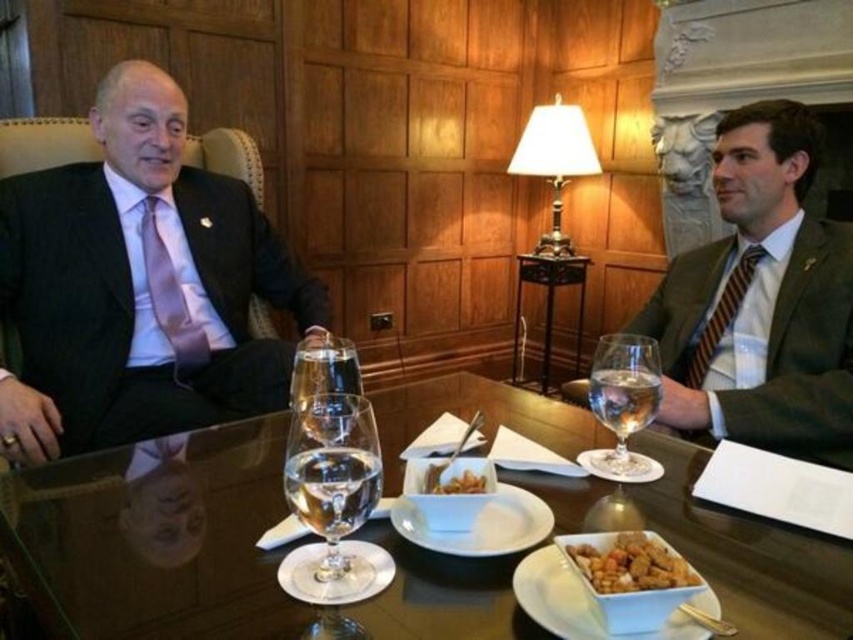
Looking at this image, you are organizing a formal event and need to determine which item takes up more space between the dark suit at left and the striped fabric tie at right. Which one should you consider for space requirements?

The dark suit at left is larger in size than the striped fabric tie at right, so you should consider the dark suit at left for space requirements.

You are an interior designer observing the scene. You need to place a decorative item between the dark suit at left and the striped fabric tie at right. Based on their positions, which object should the decorative item be closer to?

The dark suit at left is in front of the striped fabric tie at right, so the decorative item should be placed closer to the striped fabric tie at right.

Based on the scene description, can you determine if the dark suit at left is wider than the striped fabric tie at right?

The dark suit at left might be wider than striped fabric tie at right according to the objects description.